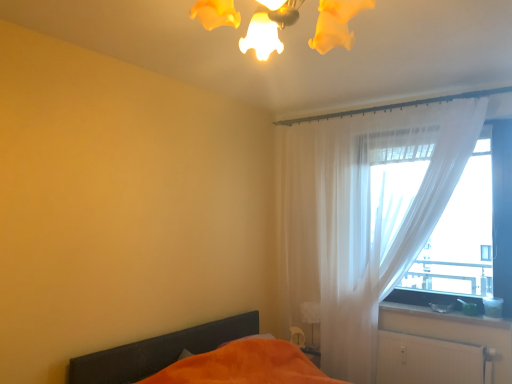
Question: From a real-world perspective, is smooth white surface at lower right physically above white textured radiator at lower right?

Choices:
 (A) yes
 (B) no

Answer: (A)

Question: Can you confirm if smooth white surface at lower right is shorter than white textured radiator at lower right?

Choices:
 (A) no
 (B) yes

Answer: (B)

Question: Is smooth white surface at lower right facing towards white textured radiator at lower right?

Choices:
 (A) no
 (B) yes

Answer: (A)

Question: Is smooth white surface at lower right wider than white textured radiator at lower right?

Choices:
 (A) no
 (B) yes

Answer: (B)

Question: Does smooth white surface at lower right come in front of white textured radiator at lower right?

Choices:
 (A) yes
 (B) no

Answer: (B)

Question: From the image's perspective, is translucent fabric at right above or below white textured radiator at lower right?

Choices:
 (A) above
 (B) below

Answer: (A)

Question: Considering their positions, is translucent fabric at right located in front of or behind white textured radiator at lower right?

Choices:
 (A) behind
 (B) front

Answer: (A)

Question: In terms of height, does translucent fabric at right look taller or shorter compared to white textured radiator at lower right?

Choices:
 (A) short
 (B) tall

Answer: (B)

Question: Is translucent fabric at right bigger or smaller than white textured radiator at lower right?

Choices:
 (A) small
 (B) big

Answer: (B)

Question: In the image, is orange fabric bed at lower left positioned in front of or behind smooth white surface at lower right?

Choices:
 (A) front
 (B) behind

Answer: (A)

Question: Is orange fabric bed at lower left inside the boundaries of smooth white surface at lower right, or outside?

Choices:
 (A) inside
 (B) outside

Answer: (B)

Question: From their relative heights in the image, would you say orange fabric bed at lower left is taller or shorter than smooth white surface at lower right?

Choices:
 (A) tall
 (B) short

Answer: (A)

Question: From the image's perspective, is orange fabric bed at lower left above or below smooth white surface at lower right?

Choices:
 (A) above
 (B) below

Answer: (B)

Question: From the image's perspective, is orange fabric bed at lower left above or below white glossy table lamp at lower right?

Choices:
 (A) below
 (B) above

Answer: (A)

Question: Would you say orange fabric bed at lower left is to the left or to the right of white glossy table lamp at lower right in the picture?

Choices:
 (A) right
 (B) left

Answer: (B)